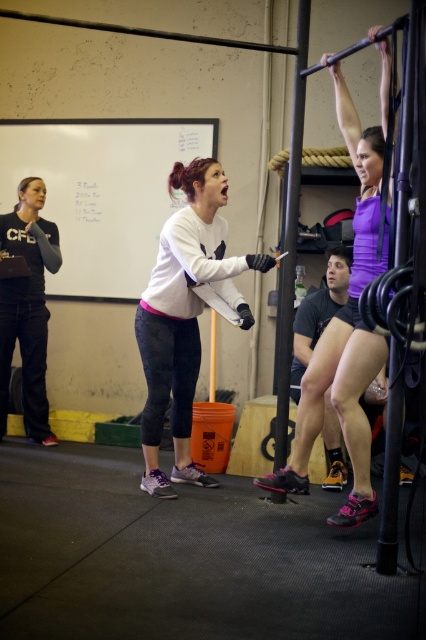
Between purple matte tank top at upper center and black matte sweatshirt at left, which one appears on the left side from the viewer's perspective?

black matte sweatshirt at left is more to the left.

Is purple matte tank top at upper center taller than black matte sweatshirt at left?

Indeed, purple matte tank top at upper center has a greater height compared to black matte sweatshirt at left.

Is point (345, 372) farther from viewer compared to point (25, 291)?

No, (345, 372) is closer to viewer.

The height and width of the screenshot is (640, 426). I want to click on purple matte tank top at upper center, so click(359, 291).

This screenshot has height=640, width=426. What do you see at coordinates (184, 316) in the screenshot? I see `white matte sweatshirt at center` at bounding box center [184, 316].

Who is more distant from viewer, (x=224, y=204) or (x=46, y=236)?

Point (x=46, y=236)

The width and height of the screenshot is (426, 640). Identify the location of white matte sweatshirt at center. (184, 316).

Which is more to the left, white matte sweatshirt at center or matte black shorts at center?

white matte sweatshirt at center

Is the position of white matte sweatshirt at center less distant than that of matte black shorts at center?

Yes, it is.

Which is in front, point (158, 401) or point (336, 461)?

Point (158, 401)

The image size is (426, 640). What are the coordinates of `white matte sweatshirt at center` in the screenshot? It's located at (184, 316).